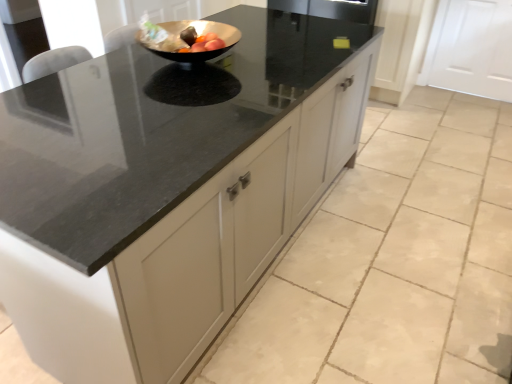
Question: Is white matte door at upper right facing away from metallic gold bowl at center?

Choices:
 (A) yes
 (B) no

Answer: (B)

Question: Considering the relative sizes of white matte door at upper right and metallic gold bowl at center in the image provided, is white matte door at upper right smaller than metallic gold bowl at center?

Choices:
 (A) no
 (B) yes

Answer: (A)

Question: Could metallic gold bowl at center be considered to be inside white matte door at upper right?

Choices:
 (A) yes
 (B) no

Answer: (B)

Question: Are white matte door at upper right and metallic gold bowl at center making contact?

Choices:
 (A) no
 (B) yes

Answer: (A)

Question: From a real-world perspective, is white matte door at upper right under metallic gold bowl at center?

Choices:
 (A) no
 (B) yes

Answer: (B)

Question: Is white matte door at upper right wider than metallic gold bowl at center?

Choices:
 (A) yes
 (B) no

Answer: (B)

Question: Considering the relative sizes of metallic gold bowl at center and white matte door at upper right in the image provided, is metallic gold bowl at center wider than white matte door at upper right?

Choices:
 (A) yes
 (B) no

Answer: (A)

Question: From the image's perspective, is metallic gold bowl at center under white matte door at upper right?

Choices:
 (A) yes
 (B) no

Answer: (A)

Question: Does metallic gold bowl at center have a smaller size compared to white matte door at upper right?

Choices:
 (A) no
 (B) yes

Answer: (B)

Question: Can you confirm if metallic gold bowl at center is thinner than white matte door at upper right?

Choices:
 (A) yes
 (B) no

Answer: (B)

Question: Is metallic gold bowl at center located outside white matte door at upper right?

Choices:
 (A) no
 (B) yes

Answer: (B)

Question: Is the surface of metallic gold bowl at center in direct contact with white matte door at upper right?

Choices:
 (A) no
 (B) yes

Answer: (A)

Question: From a real-world perspective, is white matte door at upper right above or below metallic gold bowl at center?

Choices:
 (A) below
 (B) above

Answer: (A)